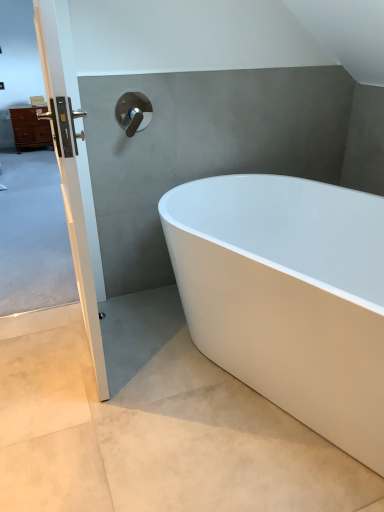
You are a GUI agent. You are given a task and a screenshot of the screen. Output one action in this format:
    pyautogui.click(x=<x>, y=<y>)
    Task: Click on the white smooth concrete at lower right
    The height and width of the screenshot is (512, 384).
    Given the screenshot: What is the action you would take?
    pyautogui.click(x=152, y=424)

Measure the distance between matte brown chest of drawers at left and camera.

matte brown chest of drawers at left and camera are 4.76 meters apart.

The image size is (384, 512). Identify the location of white glossy bathtub at center. (288, 296).

Can you confirm if polished chrome faucet at upper center is smaller than white smooth concrete at lower right?

Yes.

Is point (151, 111) less distant than point (104, 439)?

No, it is not.

This screenshot has height=512, width=384. Identify the location of tap that appears above the white smooth concrete at lower right (from a real-world perspective). (133, 112).

From the image's perspective, is polished chrome faucet at upper center located above white smooth concrete at lower right?

Correct, polished chrome faucet at upper center appears higher than white smooth concrete at lower right in the image.

Is white smooth concrete at lower right facing towards white glossy bathtub at center?

No, white smooth concrete at lower right is not aimed at white glossy bathtub at center.

Does point (138, 399) appear closer or farther from the camera than point (269, 365)?

Point (138, 399).

From the image's perspective, is white smooth concrete at lower right located above white glossy bathtub at center?

No, from the image's perspective, white smooth concrete at lower right is not on top of white glossy bathtub at center.

Where is `door above the white glossy bathtub at center (from the image's perspective)`? The image size is (384, 512). door above the white glossy bathtub at center (from the image's perspective) is located at coordinates (83, 261).

From a real-world perspective, is white glossy door handle at left physically above white glossy bathtub at center?

Yes, from a real-world perspective, white glossy door handle at left is over white glossy bathtub at center

Is the depth of white glossy door handle at left greater than that of white glossy bathtub at center?

Yes.

Does white glossy door handle at left turn towards white glossy bathtub at center?

No, white glossy door handle at left is not aimed at white glossy bathtub at center.

How distant is polished chrome faucet at upper center from white glossy door handle at left?

polished chrome faucet at upper center is 75.80 centimeters away from white glossy door handle at left.

Between polished chrome faucet at upper center and white glossy door handle at left, which one appears on the left side from the viewer's perspective?

white glossy door handle at left is more to the left.

Image resolution: width=384 pixels, height=512 pixels. What are the coordinates of `door located in front of the polished chrome faucet at upper center` in the screenshot? It's located at [x=83, y=261].

Is polished chrome faucet at upper center in contact with white glossy door handle at left?

No, polished chrome faucet at upper center is not touching white glossy door handle at left.

Identify the location of tap lying below the matte brown chest of drawers at left (from the image's perspective). This screenshot has height=512, width=384. (133, 112).

Considering the relative sizes of matte brown chest of drawers at left and polished chrome faucet at upper center in the image provided, is matte brown chest of drawers at left smaller than polished chrome faucet at upper center?

Actually, matte brown chest of drawers at left might be larger than polished chrome faucet at upper center.

From a real-world perspective, is matte brown chest of drawers at left located beneath polished chrome faucet at upper center?

Yes, from a real-world perspective, matte brown chest of drawers at left is below polished chrome faucet at upper center.

Does matte brown chest of drawers at left have a greater height compared to polished chrome faucet at upper center?

Yes.

Who is bigger, matte brown chest of drawers at left or white smooth concrete at lower right?

With larger size is white smooth concrete at lower right.

Does matte brown chest of drawers at left come in front of white smooth concrete at lower right?

No, matte brown chest of drawers at left is behind white smooth concrete at lower right.

Considering the relative positions of matte brown chest of drawers at left and white smooth concrete at lower right in the image provided, is matte brown chest of drawers at left to the left of white smooth concrete at lower right from the viewer's perspective?

Correct, you'll find matte brown chest of drawers at left to the left of white smooth concrete at lower right.

From the image's perspective, does white glossy door handle at left appear higher than white smooth concrete at lower right?

Yes, from the image's perspective, white glossy door handle at left is above white smooth concrete at lower right.

Is white glossy door handle at left turned away from white smooth concrete at lower right?

That's right, white glossy door handle at left is facing away from white smooth concrete at lower right.

Where is `concrete below the polished chrome faucet at upper center (from a real-world perspective)`? Image resolution: width=384 pixels, height=512 pixels. concrete below the polished chrome faucet at upper center (from a real-world perspective) is located at coordinates (152, 424).

Where is `bathtub above the white smooth concrete at lower right (from the image's perspective)`? bathtub above the white smooth concrete at lower right (from the image's perspective) is located at coordinates (288, 296).

Which object lies further to the anchor point white glossy door handle at left, polished chrome faucet at upper center or white smooth concrete at lower right?

polished chrome faucet at upper center lies further to white glossy door handle at left than the other object.

From the image, which object appears to be farther from matte brown chest of drawers at left, white glossy bathtub at center or white glossy door handle at left?

white glossy door handle at left lies further to matte brown chest of drawers at left than the other object.

Looking at the image, which one is located closer to white glossy door handle at left, matte brown chest of drawers at left or polished chrome faucet at upper center?

Based on the image, polished chrome faucet at upper center appears to be nearer to white glossy door handle at left.

From the picture: From the image, which object appears to be nearer to white glossy bathtub at center, white glossy door handle at left or matte brown chest of drawers at left?

white glossy door handle at left is closer to white glossy bathtub at center.

When comparing their distances from white glossy door handle at left, does polished chrome faucet at upper center or matte brown chest of drawers at left seem further?

matte brown chest of drawers at left is positioned further to the anchor white glossy door handle at left.

Estimate the real-world distances between objects in this image. Which object is further from white glossy bathtub at center, matte brown chest of drawers at left or white smooth concrete at lower right?

Based on the image, matte brown chest of drawers at left appears to be further to white glossy bathtub at center.

Looking at this image, estimate the real-world distances between objects in this image. Which object is further from white smooth concrete at lower right, white glossy door handle at left or polished chrome faucet at upper center?

polished chrome faucet at upper center.

Based on the photo, estimate the real-world distances between objects in this image. Which object is closer to polished chrome faucet at upper center, white smooth concrete at lower right or matte brown chest of drawers at left?

The object closer to polished chrome faucet at upper center is white smooth concrete at lower right.

This screenshot has height=512, width=384. I want to click on concrete located between white glossy door handle at left and white glossy bathtub at center in the left-right direction, so click(x=152, y=424).

You are a GUI agent. You are given a task and a screenshot of the screen. Output one action in this format:
    pyautogui.click(x=<x>, y=<y>)
    Task: Click on the door located between white smooth concrete at lower right and matte brown chest of drawers at left in the depth direction
    Image resolution: width=384 pixels, height=512 pixels.
    Given the screenshot: What is the action you would take?
    pyautogui.click(x=83, y=261)

The width and height of the screenshot is (384, 512). In order to click on tap positioned between white smooth concrete at lower right and matte brown chest of drawers at left from near to far in this screenshot , I will do `click(133, 112)`.

You are a GUI agent. You are given a task and a screenshot of the screen. Output one action in this format:
    pyautogui.click(x=<x>, y=<y>)
    Task: Click on the tap located between white glossy bathtub at center and matte brown chest of drawers at left in the depth direction
    
    Given the screenshot: What is the action you would take?
    pyautogui.click(x=133, y=112)